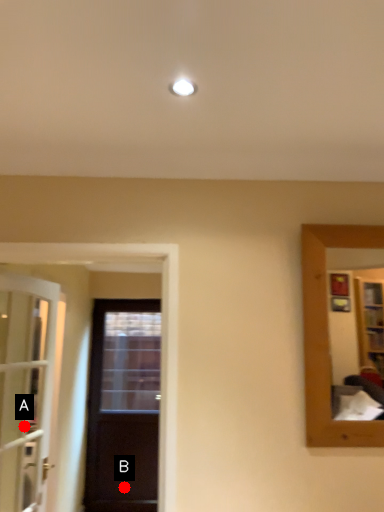
Question: Two points are circled on the image, labeled by A and B beside each circle. Which point appears farthest from the camera in this image?

Choices:
 (A) A is further
 (B) B is further

Answer: (B)